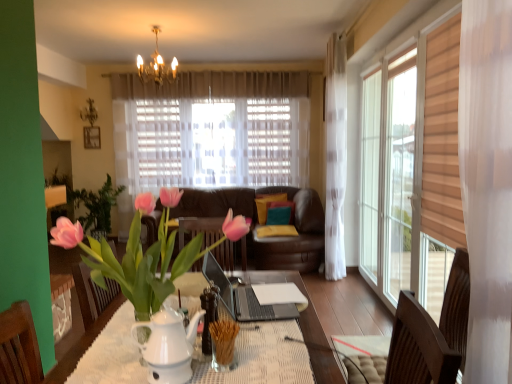
Question: Considering the positions of point (89, 135) and point (162, 211), is point (89, 135) closer or farther from the camera than point (162, 211)?

Choices:
 (A) closer
 (B) farther

Answer: (B)

Question: In terms of width, does wooden picture frame at upper left look wider or thinner when compared to pink glossy tulip at center?

Choices:
 (A) thin
 (B) wide

Answer: (A)

Question: Which object is the closest to the velvet teal pillow at center, arranged as the 1th pillow when viewed from the front?

Choices:
 (A) gold crystal chandelier at upper center
 (B) pink glossy tulip at center
 (C) wooden picture frame at upper left
 (D) velvet yellow pillow at center, the second pillow from the front

Answer: (D)

Question: Which of these objects is positioned farthest from the wooden picture frame at upper left?

Choices:
 (A) pink glossy tulip at center
 (B) velvet yellow pillow at center, placed as the first pillow when sorted from back to front
 (C) gold crystal chandelier at upper center
 (D) velvet teal pillow at center, arranged as the 1th pillow when viewed from the front

Answer: (A)